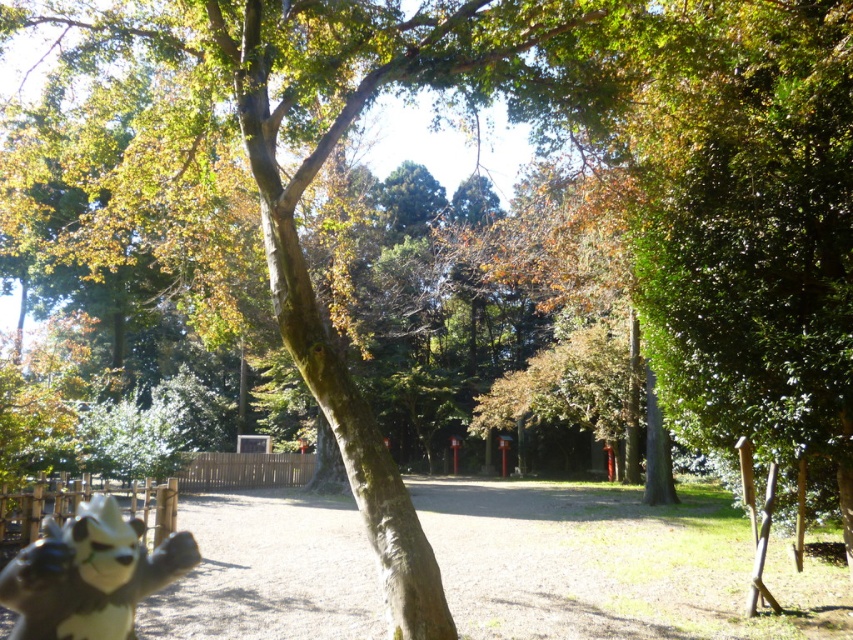
Does point (270, 572) come closer to viewer compared to point (16, 621)?

That is False.

Who is more forward, (607, 541) or (51, 570)?

Point (51, 570) is more forward.

Is point (212, 625) positioned behind point (62, 566)?

Yes, point (212, 625) is behind point (62, 566).

Locate an element on the screen. dirt ground at center is located at coordinates (613, 564).